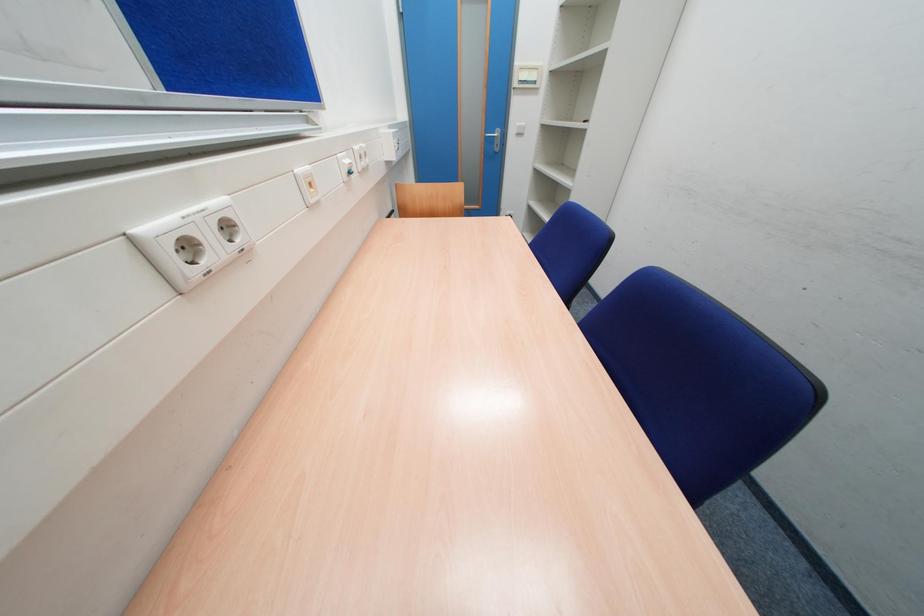
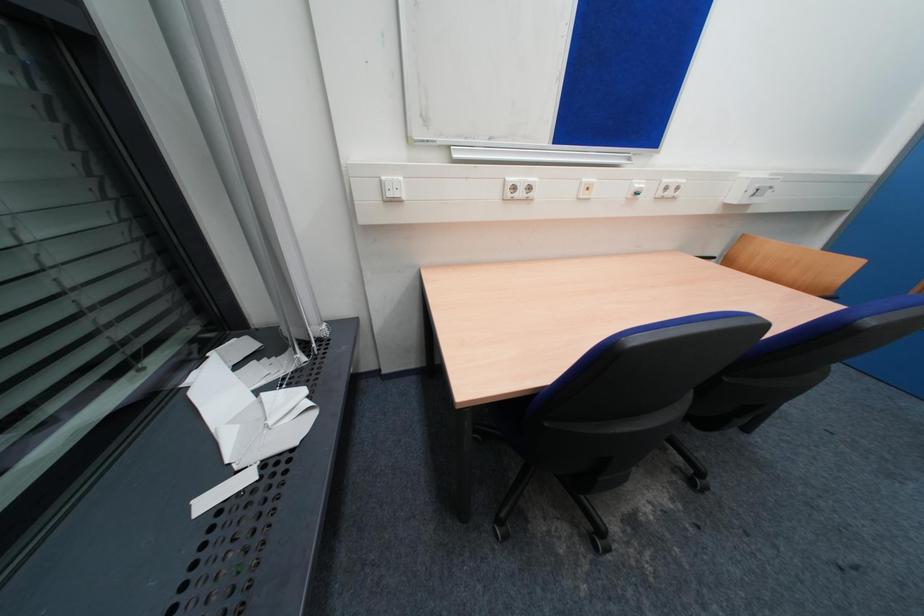
The first image is from the beginning of the video and the second image is from the end. How did the camera likely rotate when shooting the video?

The camera's rotation is toward left-down.